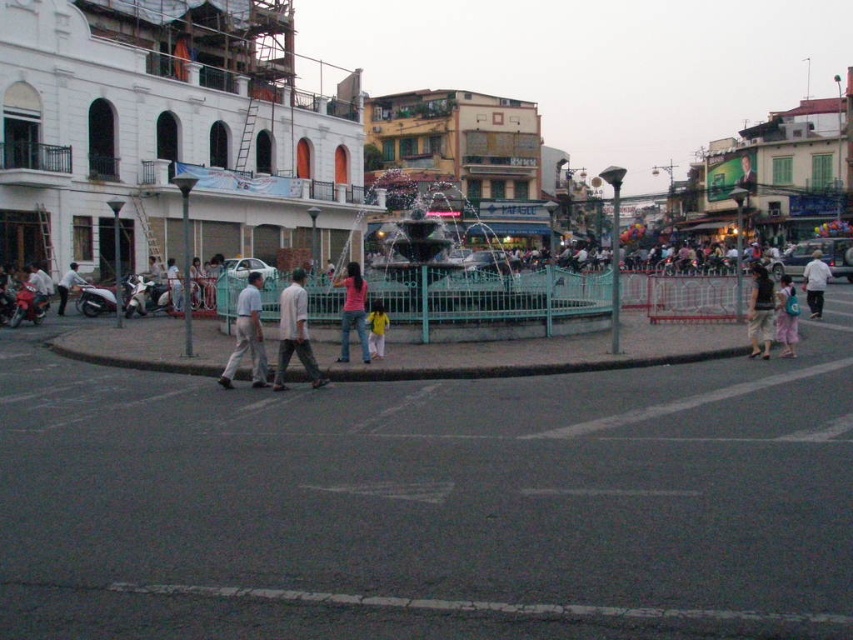
Question: Does dark gray fabric shirt at right have a lesser width compared to pink fabric bag at lower right?

Choices:
 (A) no
 (B) yes

Answer: (B)

Question: From the image, what is the correct spatial relationship of white matte shirt at center in relation to yellow matte shirt at center?

Choices:
 (A) right
 (B) left

Answer: (A)

Question: Which of these objects is positioned farthest from the yellow matte shirt at center?

Choices:
 (A) dark gray fabric shirt at right
 (B) light gray pants at left
 (C) light brown cotton pants at center
 (D) gray matte pants at center

Answer: (B)

Question: Which is farther from the light gray pants at left?

Choices:
 (A) yellow matte shirt at center
 (B) white matte shirt at center
 (C) pink fabric at center

Answer: (B)

Question: Which is nearer to the dark gray fabric shirt at right?

Choices:
 (A) yellow matte shirt at center
 (B) gray matte pants at center

Answer: (A)

Question: Is pink fabric bag at lower right positioned at the back of white matte shirt at center?

Choices:
 (A) no
 (B) yes

Answer: (A)